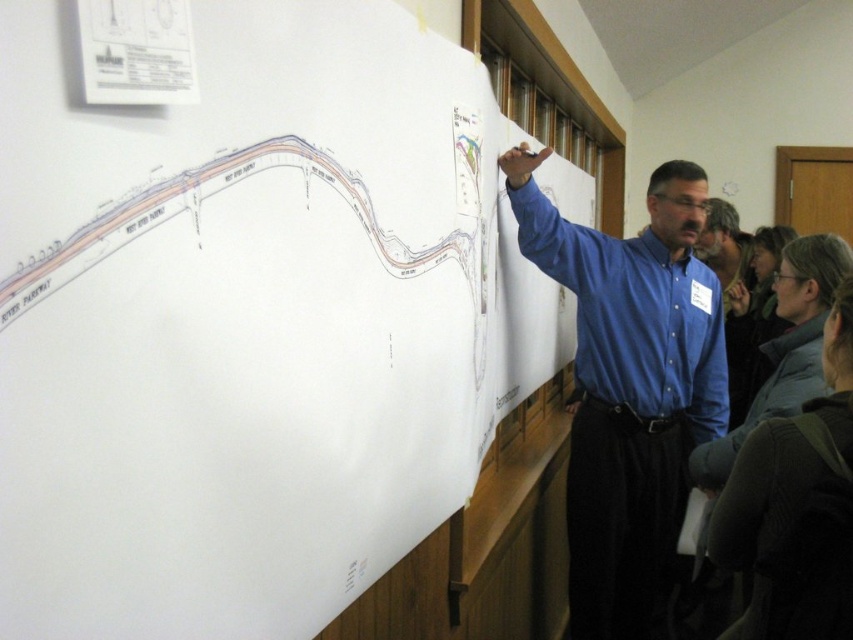
Question: Which object is closer to the camera taking this photo?

Choices:
 (A) white paper at upper center
 (B) blue shirt at upper right

Answer: (A)

Question: Does white paper at upper center have a larger size compared to blue shirt at upper right?

Choices:
 (A) yes
 (B) no

Answer: (A)

Question: Does white paper at upper center have a lesser width compared to blue shirt at upper right?

Choices:
 (A) no
 (B) yes

Answer: (B)

Question: Which of the following is the farthest from the observer?

Choices:
 (A) (262, 216)
 (B) (553, 237)

Answer: (B)

Question: Is white paper at upper center positioned behind blue shirt at upper right?

Choices:
 (A) yes
 (B) no

Answer: (B)